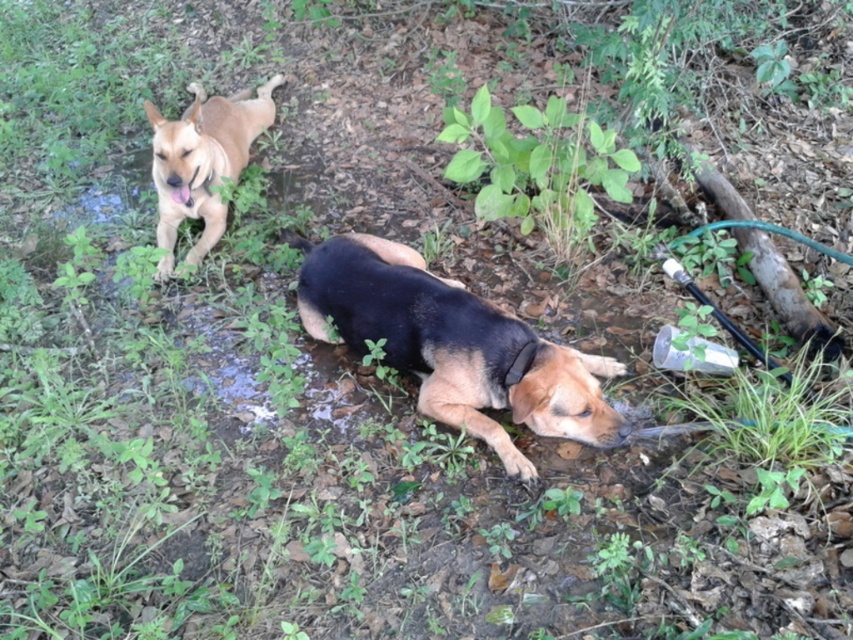
Question: Does black smooth dog at center have a lesser width compared to light brown fur at upper left?

Choices:
 (A) no
 (B) yes

Answer: (A)

Question: Is black smooth dog at center behind light brown fur at upper left?

Choices:
 (A) no
 (B) yes

Answer: (A)

Question: Is black smooth dog at center behind light brown fur at upper left?

Choices:
 (A) no
 (B) yes

Answer: (A)

Question: Which object appears closest to the camera in this image?

Choices:
 (A) light brown fur at upper left
 (B) black smooth dog at center

Answer: (B)

Question: Which point is closer to the camera?

Choices:
 (A) black smooth dog at center
 (B) light brown fur at upper left

Answer: (A)